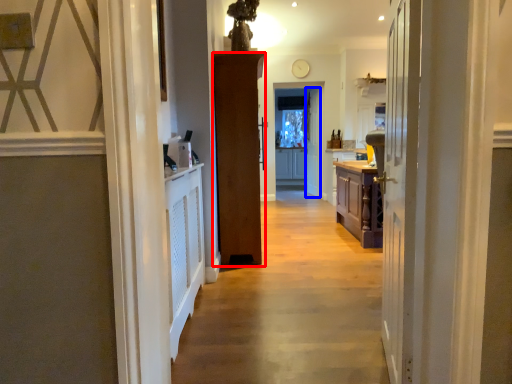
Question: Among these objects, which one is nearest to the camera, door (highlighted by a red box) or door (highlighted by a blue box)?

Choices:
 (A) door
 (B) door

Answer: (A)